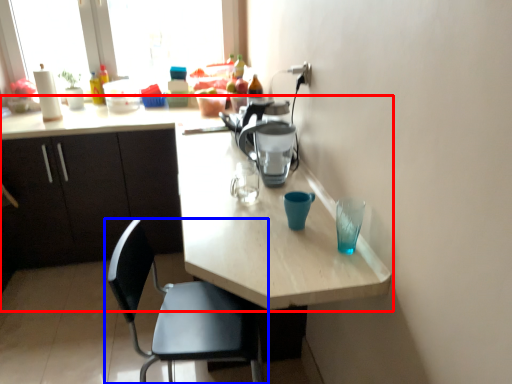
Question: Which object appears closest to the camera in this image, kitchen & dining room table (highlighted by a red box) or chair (highlighted by a blue box)?

Choices:
 (A) kitchen & dining room table
 (B) chair

Answer: (A)